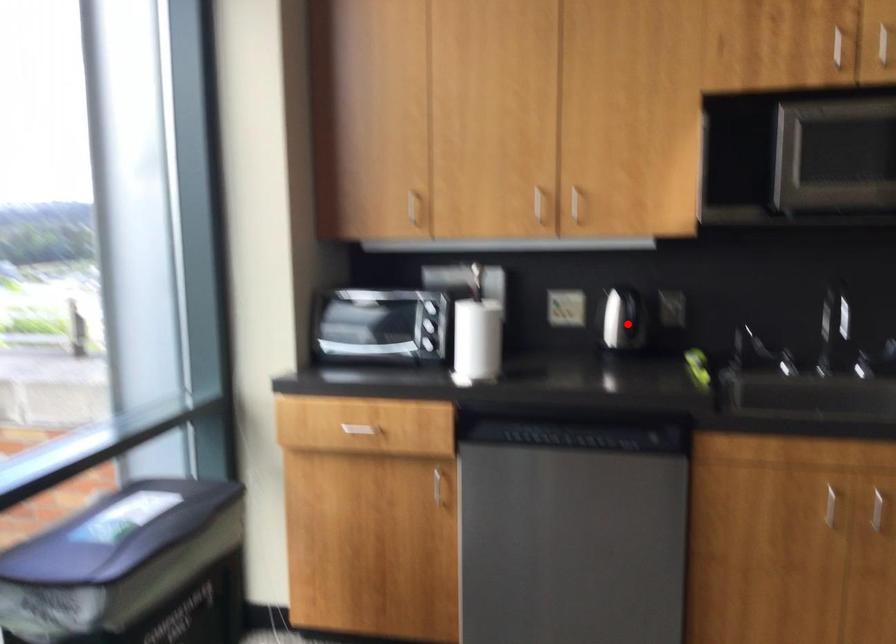
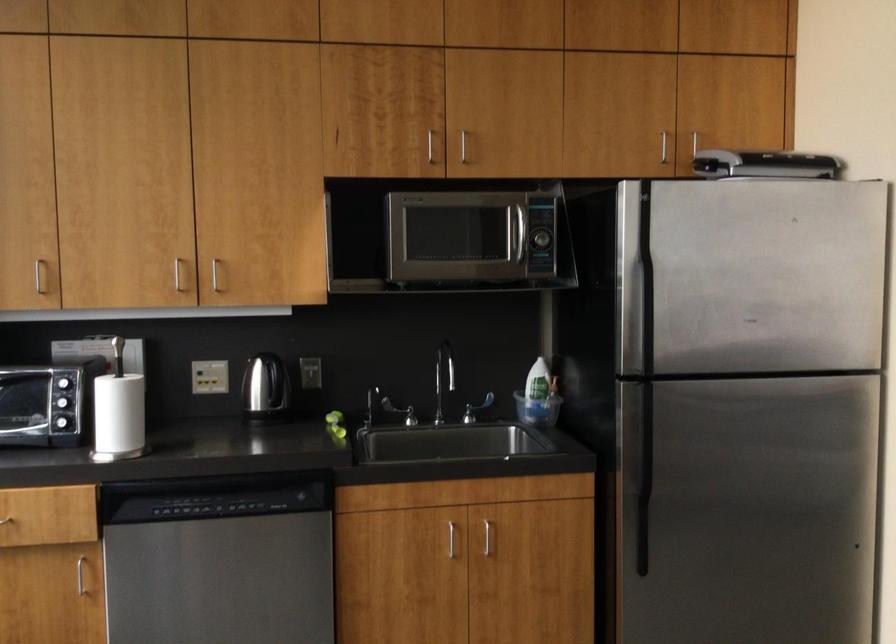
The point at the highlighted location is marked in the first image. Where is the corresponding point in the second image?

(266, 391)